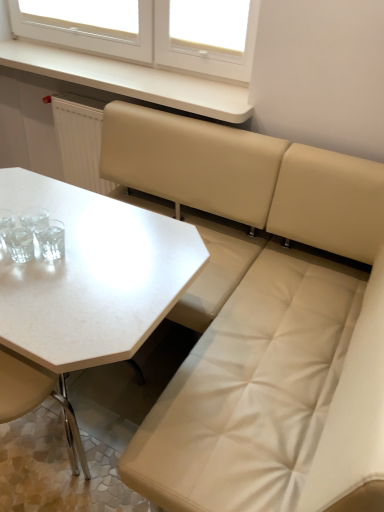
Question: Can we say transparent plastic at upper center lies outside beige leather chair at lower left?

Choices:
 (A) no
 (B) yes

Answer: (B)

Question: Are transparent plastic at upper center and beige leather chair at lower left beside each other?

Choices:
 (A) no
 (B) yes

Answer: (A)

Question: From the image's perspective, is transparent plastic at upper center located beneath beige leather chair at lower left?

Choices:
 (A) yes
 (B) no

Answer: (B)

Question: Is beige leather chair at lower left inside transparent plastic at upper center?

Choices:
 (A) yes
 (B) no

Answer: (B)

Question: Is the position of transparent plastic at upper center more distant than that of beige leather chair at lower left?

Choices:
 (A) no
 (B) yes

Answer: (B)

Question: From the image's perspective, is transparent plastic at upper center positioned above or below white matte table at center?

Choices:
 (A) below
 (B) above

Answer: (B)

Question: Which is correct: transparent plastic at upper center is inside white matte table at center, or outside of it?

Choices:
 (A) inside
 (B) outside

Answer: (B)

Question: Is transparent plastic at upper center taller or shorter than white matte table at center?

Choices:
 (A) short
 (B) tall

Answer: (A)

Question: Is point (177, 23) positioned closer to the camera than point (31, 279)?

Choices:
 (A) farther
 (B) closer

Answer: (A)

Question: In the image, is transparent plastic at upper center on the left side or the right side of beige leather chair at lower left?

Choices:
 (A) left
 (B) right

Answer: (B)

Question: From a real-world perspective, relative to beige leather chair at lower left, is transparent plastic at upper center vertically above or below?

Choices:
 (A) above
 (B) below

Answer: (A)

Question: Considering the positions of transparent plastic at upper center and beige leather chair at lower left in the image, is transparent plastic at upper center wider or thinner than beige leather chair at lower left?

Choices:
 (A) wide
 (B) thin

Answer: (B)

Question: From the image's perspective, relative to beige leather chair at lower left, is transparent plastic at upper center above or below?

Choices:
 (A) above
 (B) below

Answer: (A)

Question: In terms of size, does white matte counter top at upper center appear bigger or smaller than white matte table at center?

Choices:
 (A) small
 (B) big

Answer: (A)

Question: Relative to white matte table at center, is white matte counter top at upper center in front or behind?

Choices:
 (A) front
 (B) behind

Answer: (B)